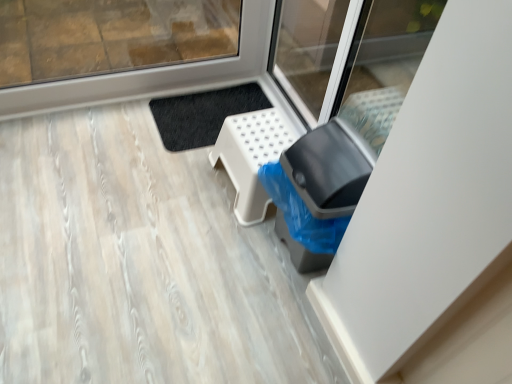
Question: Considering the relative sizes of white plastic stool at lower center and black plastic trash can at lower right in the image provided, is white plastic stool at lower center thinner than black plastic trash can at lower right?

Choices:
 (A) no
 (B) yes

Answer: (A)

Question: Is white plastic stool at lower center further to the viewer compared to black plastic trash can at lower right?

Choices:
 (A) yes
 (B) no

Answer: (A)

Question: Considering the relative sizes of white plastic stool at lower center and black plastic trash can at lower right in the image provided, is white plastic stool at lower center wider than black plastic trash can at lower right?

Choices:
 (A) yes
 (B) no

Answer: (A)

Question: Is white plastic stool at lower center outside black plastic trash can at lower right?

Choices:
 (A) yes
 (B) no

Answer: (A)

Question: Is black plastic trash can at lower right inside white plastic stool at lower center?

Choices:
 (A) no
 (B) yes

Answer: (A)

Question: Is white plastic stool at lower center facing away from black plastic trash can at lower right?

Choices:
 (A) yes
 (B) no

Answer: (B)

Question: Does black plastic trash can at lower right have a larger size compared to white plastic stool at lower center?

Choices:
 (A) yes
 (B) no

Answer: (A)

Question: From the image's perspective, would you say black plastic trash can at lower right is positioned over white plastic stool at lower center?

Choices:
 (A) yes
 (B) no

Answer: (B)

Question: Does black plastic trash can at lower right have a smaller size compared to white plastic stool at lower center?

Choices:
 (A) yes
 (B) no

Answer: (B)

Question: Is black plastic trash can at lower right positioned with its back to white plastic stool at lower center?

Choices:
 (A) yes
 (B) no

Answer: (B)

Question: Is black plastic trash can at lower right to the left of white plastic stool at lower center from the viewer's perspective?

Choices:
 (A) yes
 (B) no

Answer: (B)

Question: From the image's perspective, is black plastic trash can at lower right located beneath white plastic stool at lower center?

Choices:
 (A) no
 (B) yes

Answer: (B)

Question: Is point (368, 158) positioned closer to the camera than point (289, 124)?

Choices:
 (A) farther
 (B) closer

Answer: (B)